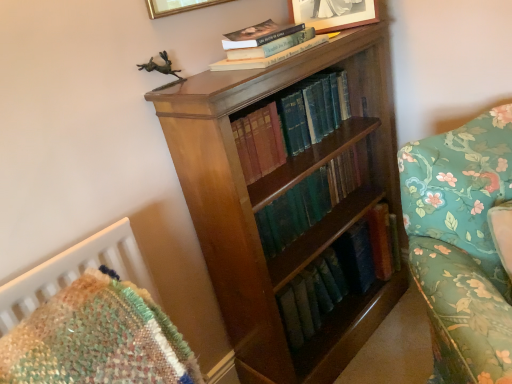
Question: Which direction should I rotate to look at hardcover book at upper center, marked as the third book in a bottom-to-top arrangement?

Choices:
 (A) right
 (B) left

Answer: (A)

Question: Would you say floral fabric couch at right is outside gold metallic picture frame at upper center, arranged as the 1th picture frame when viewed from the left?

Choices:
 (A) no
 (B) yes

Answer: (B)

Question: From a real-world perspective, is floral fabric couch at right over gold metallic picture frame at upper center, the 2th picture frame viewed from the right?

Choices:
 (A) no
 (B) yes

Answer: (A)

Question: Is floral fabric couch at right closer to the viewer compared to gold metallic picture frame at upper center, the 2th picture frame viewed from the right?

Choices:
 (A) no
 (B) yes

Answer: (B)

Question: Considering the relative sizes of floral fabric couch at right and gold metallic picture frame at upper center, arranged as the 1th picture frame when viewed from the left, in the image provided, is floral fabric couch at right taller than gold metallic picture frame at upper center, arranged as the 1th picture frame when viewed from the left,?

Choices:
 (A) no
 (B) yes

Answer: (B)

Question: Is gold metallic picture frame at upper center, the 2th picture frame viewed from the right, surrounded by floral fabric couch at right?

Choices:
 (A) yes
 (B) no

Answer: (B)

Question: Is the surface of floral fabric couch at right in direct contact with gold metallic picture frame at upper center, arranged as the 1th picture frame when viewed from the left?

Choices:
 (A) yes
 (B) no

Answer: (B)

Question: Does hardcover book at upper center, marked as the third book in a bottom-to-top arrangement, contain green leather book at center, the second book when ordered from top to bottom?

Choices:
 (A) no
 (B) yes

Answer: (A)

Question: Can you confirm if hardcover book at upper center, marked as the third book in a bottom-to-top arrangement, is positioned to the right of green leather book at center, the second book when ordered from top to bottom?

Choices:
 (A) yes
 (B) no

Answer: (B)

Question: Considering the relative sizes of hardcover book at upper center, marked as the third book in a bottom-to-top arrangement, and green leather book at center, which is counted as the 2th book, starting from the bottom, in the image provided, is hardcover book at upper center, marked as the third book in a bottom-to-top arrangement, smaller than green leather book at center, which is counted as the 2th book, starting from the bottom,?

Choices:
 (A) yes
 (B) no

Answer: (A)

Question: Does hardcover book at upper center, marked as the third book in a bottom-to-top arrangement, appear on the left side of green leather book at center, which is counted as the 2th book, starting from the bottom?

Choices:
 (A) no
 (B) yes

Answer: (B)

Question: From the image's perspective, would you say hardcover book at upper center, which ranks as the first book in top-to-bottom order, is positioned over green leather book at center, the second book when ordered from top to bottom?

Choices:
 (A) yes
 (B) no

Answer: (A)

Question: Could you tell me if hardcover book at upper center, marked as the third book in a bottom-to-top arrangement, is turned towards green leather book at center, which is counted as the 2th book, starting from the bottom?

Choices:
 (A) yes
 (B) no

Answer: (B)

Question: Is shiny brown wood bookcase at center to the right of matte silver picture frame at upper center, the 1th picture frame positioned from the right, from the viewer's perspective?

Choices:
 (A) yes
 (B) no

Answer: (B)